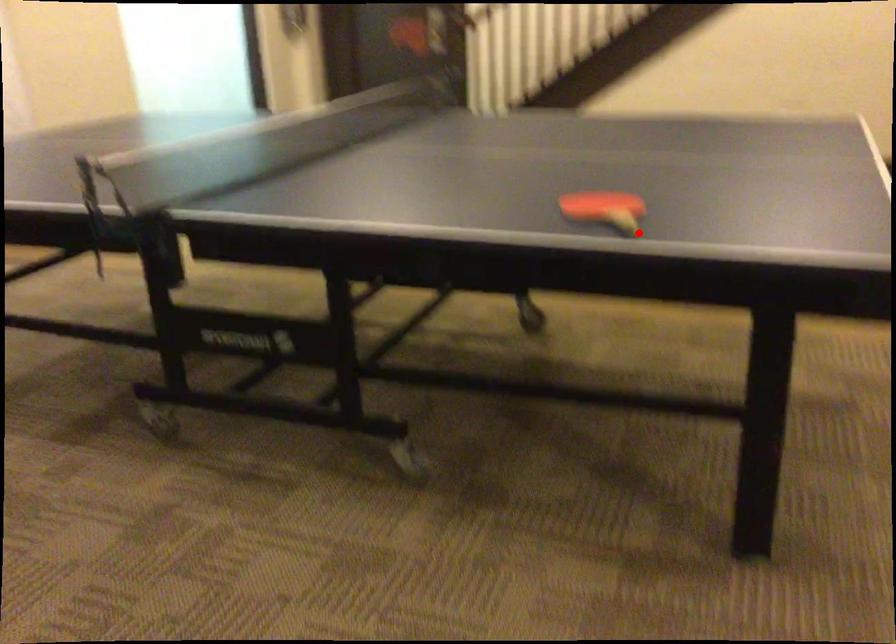
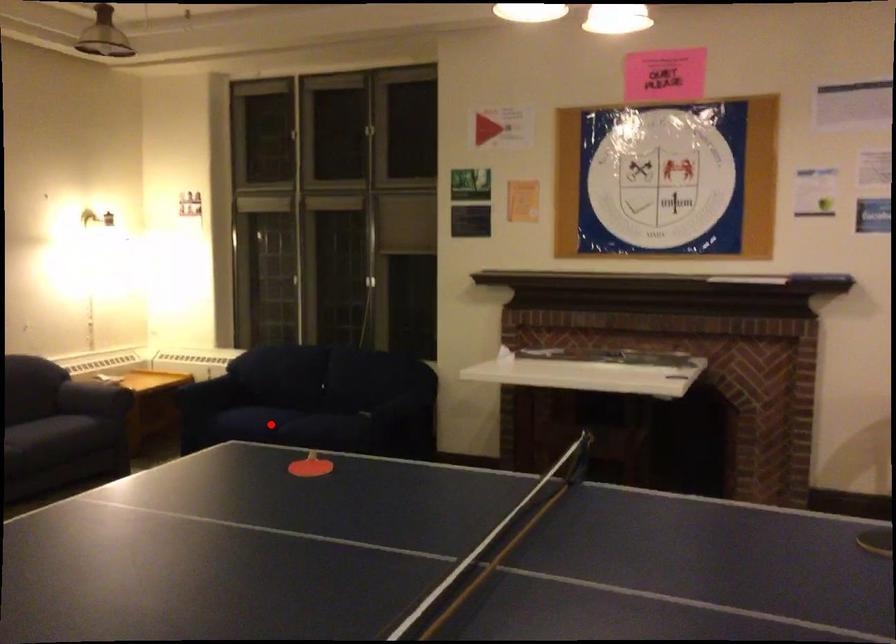
I am providing you with two images of the same scene from different viewpoints. A red point is marked on the first image and another point is marked on the second image. Do the highlighted points in image1 and image2 indicate the same real-world spot?

No